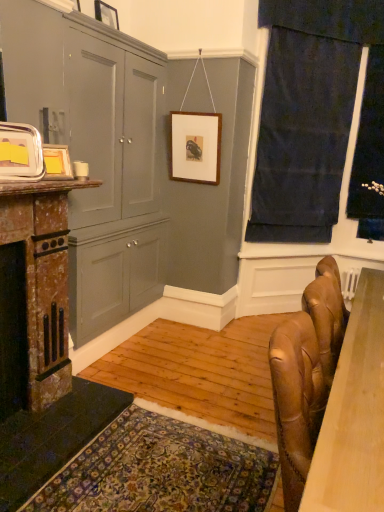
Question: Is point (218, 158) closer or farther from the camera than point (114, 12)?

Choices:
 (A) farther
 (B) closer

Answer: (A)

Question: In terms of height, does wooden picture frame at center, the 3th picture frame ordered from the bottom, look taller or shorter compared to wooden picture frame at upper center, marked as the fourth picture frame in a bottom-to-top arrangement?

Choices:
 (A) short
 (B) tall

Answer: (B)

Question: Which is nearer to the metallic silver picture frame at upper left, marked as the 1th picture frame in a left-to-right arrangement?

Choices:
 (A) matte yellow picture frame at left, the third picture frame positioned from the top
 (B) matte gray cabinet at left
 (C) wooden picture frame at upper center, which is counted as the 1th picture frame, starting from the top
 (D) black velvet curtain at right
 (E) rustic stone fireplace at left

Answer: (A)

Question: Considering the real-world distances, which object is farthest from the matte gray cabinet at left?

Choices:
 (A) wooden picture frame at center, which is the fourth picture frame from front to back
 (B) metallic silver picture frame at upper left, which appears as the 1th picture frame when ordered from the bottom
 (C) rustic stone fireplace at left
 (D) wooden picture frame at upper center, which ranks as the second picture frame in right-to-left order
 (E) smooth brown leather table at lower right

Answer: (E)